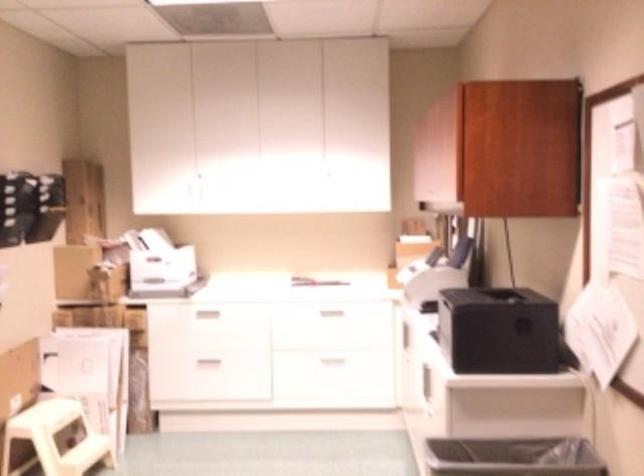
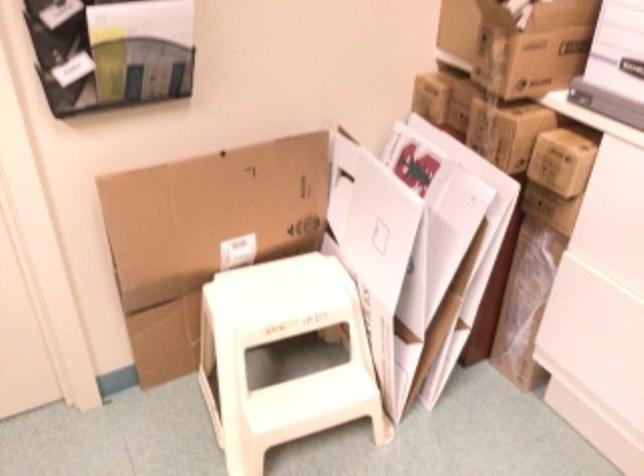
The point at (111, 355) is marked in the first image. Where is the corresponding point in the second image?

(453, 228)